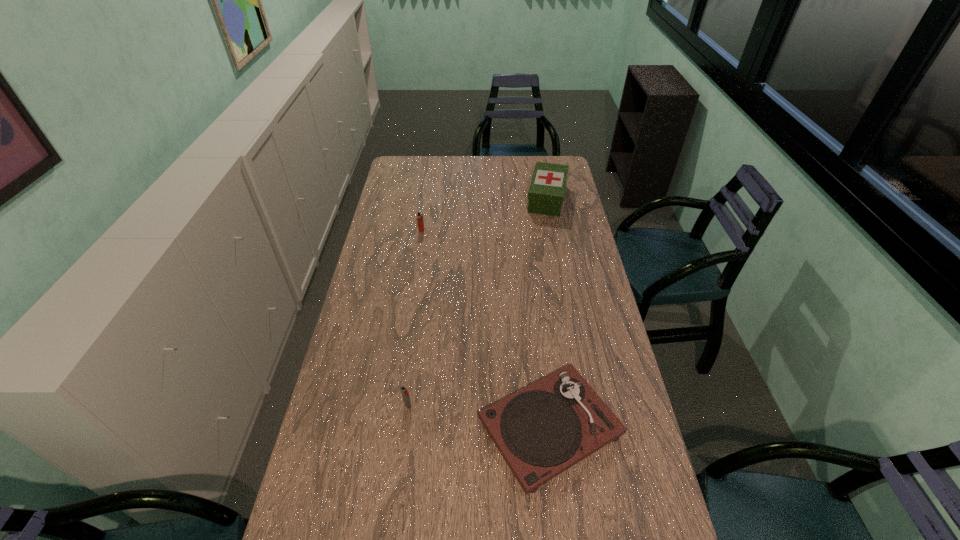
The image size is (960, 540). What are the coordinates of `the first-aid kit located at the right edge` in the screenshot? It's located at (546, 193).

Locate an element on the screen. phonograph_record present at the right edge is located at coordinates (542, 430).

Locate an element on the screen. Image resolution: width=960 pixels, height=540 pixels. free spot at the far edge of the desktop is located at coordinates (466, 174).

The height and width of the screenshot is (540, 960). In order to click on vacant position at the left edge of the desktop in this screenshot , I will do `click(393, 308)`.

Where is `free spot at the right edge of the desktop`? free spot at the right edge of the desktop is located at coordinates (579, 257).

Find the location of a particular element. free spot between the second farthest object and the first-aid kit is located at coordinates (484, 214).

This screenshot has height=540, width=960. I want to click on free space between the phonograph_record and the first-aid kit, so click(x=548, y=313).

Locate an element on the screen. free space between the farthest object and the phonograph_record is located at coordinates (548, 313).

This screenshot has width=960, height=540. What are the coordinates of `free spot between the phonograph_record and the first-aid kit` in the screenshot? It's located at (548, 313).

The width and height of the screenshot is (960, 540). In order to click on unoccupied area between the nearer igniter and the second farthest object in this screenshot , I will do `click(415, 318)`.